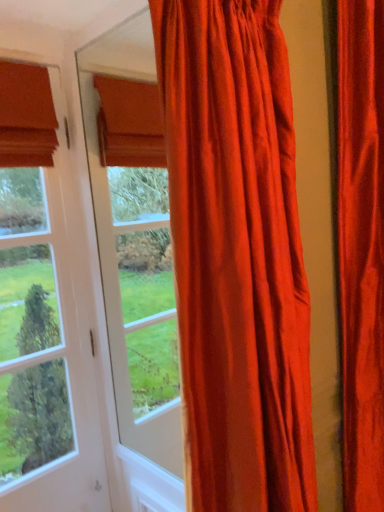
Question: Is clear glass door at left to the right of satin red curtain at right, which is the second curtain in left-to-right order, from the viewer's perspective?

Choices:
 (A) no
 (B) yes

Answer: (A)

Question: From the image's perspective, is clear glass door at left on top of satin red curtain at right, which is the second curtain in left-to-right order?

Choices:
 (A) no
 (B) yes

Answer: (A)

Question: From the image's perspective, does clear glass door at left appear lower than satin red curtain at right, which is the second curtain in left-to-right order?

Choices:
 (A) no
 (B) yes

Answer: (B)

Question: Is clear glass door at left directly adjacent to satin red curtain at right, which is the second curtain in left-to-right order?

Choices:
 (A) yes
 (B) no

Answer: (B)

Question: Is clear glass door at left located outside satin red curtain at right, the first curtain when ordered from right to left?

Choices:
 (A) no
 (B) yes

Answer: (B)

Question: Is point (364, 437) closer or farther from the camera than point (3, 442)?

Choices:
 (A) closer
 (B) farther

Answer: (A)

Question: Which is correct: satin red curtain at right, which is the second curtain in left-to-right order, is inside clear glass door at left, or outside of it?

Choices:
 (A) inside
 (B) outside

Answer: (B)

Question: From the image's perspective, is satin red curtain at right, the first curtain when ordered from right to left, located above or below clear glass door at left?

Choices:
 (A) below
 (B) above

Answer: (B)

Question: Visually, is satin red curtain at right, the first curtain when ordered from right to left, positioned to the left or to the right of clear glass door at left?

Choices:
 (A) right
 (B) left

Answer: (A)

Question: Is clear glass door at left bigger or smaller than satin orange curtain at center, which is counted as the second curtain, starting from the right?

Choices:
 (A) small
 (B) big

Answer: (A)

Question: From a real-world perspective, is clear glass door at left above or below satin orange curtain at center, which is the 1th curtain in left-to-right order?

Choices:
 (A) above
 (B) below

Answer: (B)

Question: Is clear glass door at left to the left or to the right of satin orange curtain at center, which is the 1th curtain in left-to-right order, in the image?

Choices:
 (A) right
 (B) left

Answer: (B)

Question: In terms of height, does clear glass door at left look taller or shorter compared to satin orange curtain at center, which is the 1th curtain in left-to-right order?

Choices:
 (A) short
 (B) tall

Answer: (B)

Question: Is satin red curtain at right, the first curtain when ordered from right to left, taller or shorter than satin orange curtain at center, which is the 1th curtain in left-to-right order?

Choices:
 (A) short
 (B) tall

Answer: (B)

Question: Is satin red curtain at right, which is the second curtain in left-to-right order, inside or outside of satin orange curtain at center, which is counted as the second curtain, starting from the right?

Choices:
 (A) inside
 (B) outside

Answer: (B)